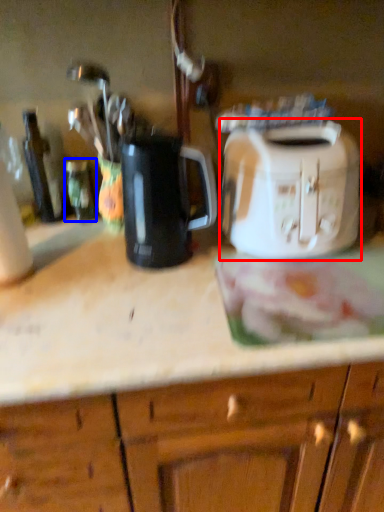
Question: Which object appears closest to the camera in this image, toaster (highlighted by a red box) or bottle (highlighted by a blue box)?

Choices:
 (A) toaster
 (B) bottle

Answer: (A)